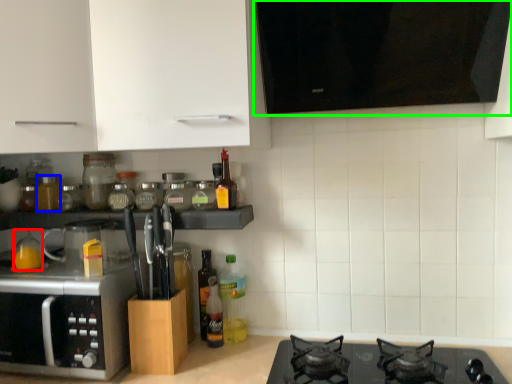
Question: Based on their relative distances, which object is nearer to bottle (highlighted by a red box)? Choose from bottle (highlighted by a blue box) and vent (highlighted by a green box).

Choices:
 (A) bottle
 (B) vent

Answer: (A)